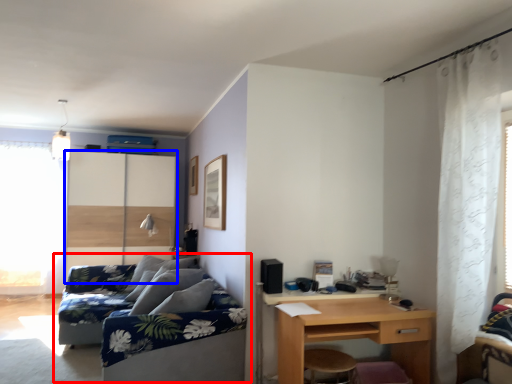
Question: Which of the following is the closest to the observer, studio couch (highlighted by a red box) or screen door (highlighted by a blue box)?

Choices:
 (A) studio couch
 (B) screen door

Answer: (A)